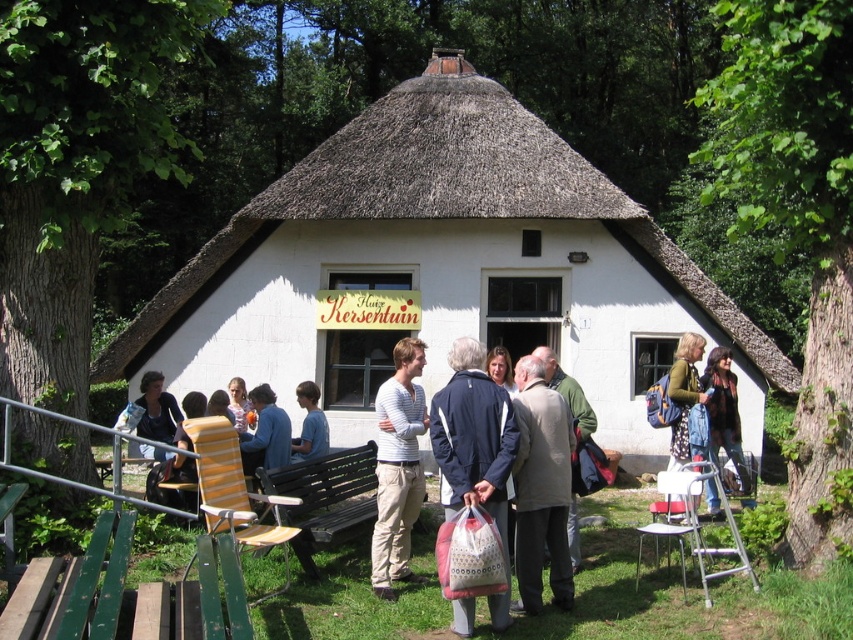
You are organizing a photo shoot and need to ensure that the blue cotton shirt at center and the light pink fabric dress at center are visible in the frame. Given their sizes, which one might require more space to fully capture in the photo?

The light pink fabric dress at center requires more space because it is thicker than the blue cotton shirt at center.

You are a photographer trying to capture a group photo of the people in front of the traditional thatched roof building. You notice the light brown wool coat at center and the blue denim jacket at center. Which clothing item should you adjust to ensure both are fully visible in the frame?

The light brown wool coat at center is taller than the blue denim jacket at center, so you should adjust the light brown wool coat at center to ensure it doesn not block the view of the blue denim jacket at center.

You are a photographer trying to capture a group photo of the people in front of Huis Kersentuin. You notice the blue cotton shirt at center and the light pink fabric dress at center. Which clothing item should you focus on to ensure it appears in the foreground of the photo?

The blue cotton shirt at center is in front of the light pink fabric dress at center, so focusing on the blue cotton shirt at center will ensure it appears in the foreground.